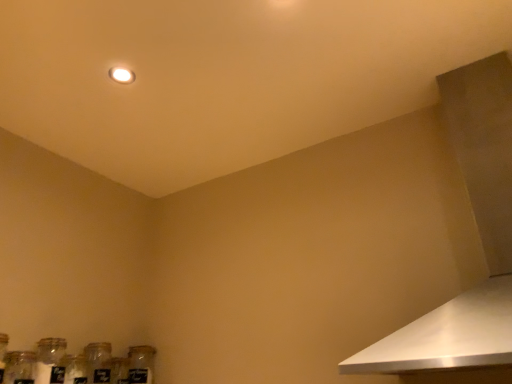
Question: From the image's perspective, does clear glass jar at lower left appear lower than clear glass jar at lower left, which ranks as the 1th bottle in left-to-right order?

Choices:
 (A) no
 (B) yes

Answer: (A)

Question: Is clear glass jar at lower left directly adjacent to clear glass jar at lower left, which ranks as the 1th bottle in left-to-right order?

Choices:
 (A) yes
 (B) no

Answer: (A)

Question: Is clear glass jar at lower left bigger than clear glass jar at lower left, which ranks as the 1th bottle in left-to-right order?

Choices:
 (A) yes
 (B) no

Answer: (B)

Question: Is clear glass jar at lower left at the right side of clear glass jar at lower left, which is the second bottle from right to left?

Choices:
 (A) no
 (B) yes

Answer: (A)

Question: Is clear glass jar at lower left outside clear glass jar at lower left, which is the second bottle from right to left?

Choices:
 (A) yes
 (B) no

Answer: (A)

Question: Is the depth of clear glass jar at lower left less than that of clear glass jar at lower left, which is the second bottle from right to left?

Choices:
 (A) no
 (B) yes

Answer: (B)

Question: Is white metallic vent at upper right looking in the opposite direction of clear glass jar at lower left, the second bottle from the left?

Choices:
 (A) no
 (B) yes

Answer: (A)

Question: Can you confirm if white metallic vent at upper right is wider than clear glass jar at lower left, the second bottle from the left?

Choices:
 (A) yes
 (B) no

Answer: (A)

Question: Is white metallic vent at upper right at the left side of clear glass jar at lower left, the second bottle from the left?

Choices:
 (A) yes
 (B) no

Answer: (B)

Question: Is white metallic vent at upper right smaller than clear glass jar at lower left, which is counted as the 1th bottle, starting from the right?

Choices:
 (A) yes
 (B) no

Answer: (B)

Question: Is white metallic vent at upper right outside of clear glass jar at lower left, which is counted as the 1th bottle, starting from the right?

Choices:
 (A) yes
 (B) no

Answer: (A)

Question: Is clear glass jar at lower left, the second bottle from the left, a part of white metallic vent at upper right?

Choices:
 (A) no
 (B) yes

Answer: (A)

Question: Is white metallic vent at upper right positioned far away from clear glass jar at lower left?

Choices:
 (A) no
 (B) yes

Answer: (B)